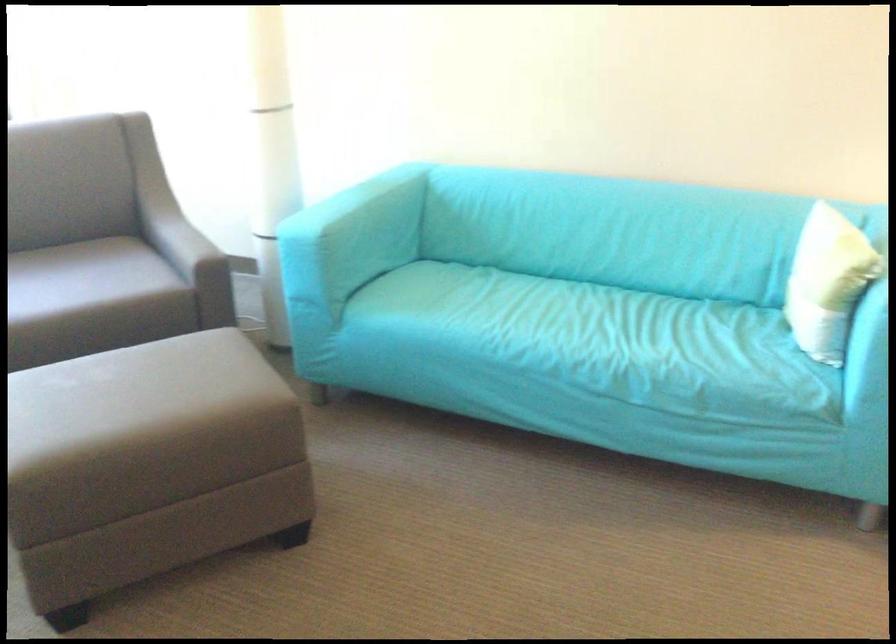
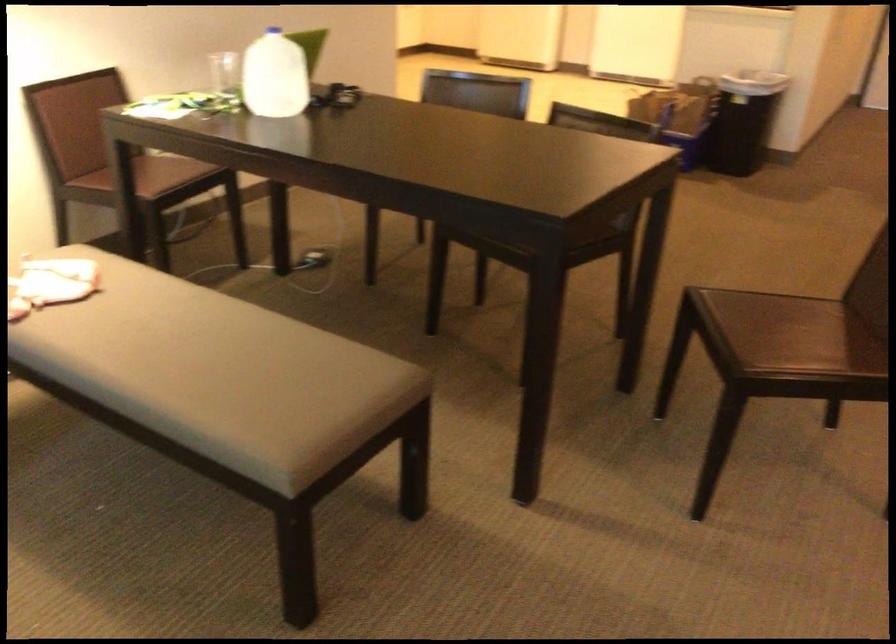
First-person continuous shooting, in which direction is the camera rotating?

The camera rotated toward right-down.